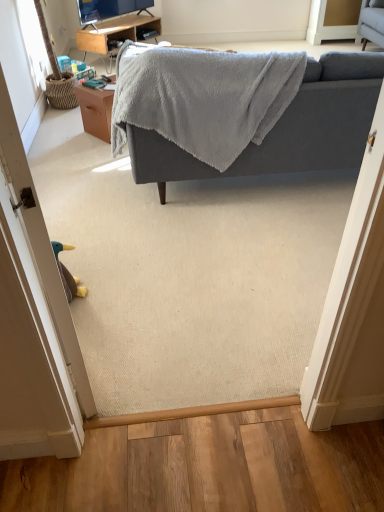
Question: Is woodendesk at upper center in front of or behind gray soft fabric couch at upper center in the image?

Choices:
 (A) behind
 (B) front

Answer: (A)

Question: Is woodendesk at upper center taller or shorter than gray soft fabric couch at upper center?

Choices:
 (A) tall
 (B) short

Answer: (B)

Question: Which object is the farthest from the brown fabric door at lower left?

Choices:
 (A) woodendesk at upper center
 (B) brown wood table at center
 (C) gray soft fabric couch at upper center
 (D) white glossy screen door at upper right

Answer: (D)

Question: Based on their relative distances, which object is nearer to the gray soft fabric couch at upper center?

Choices:
 (A) brown wood table at center
 (B) brown fabric door at lower left
 (C) white glossy screen door at upper right
 (D) woodendesk at upper center

Answer: (A)